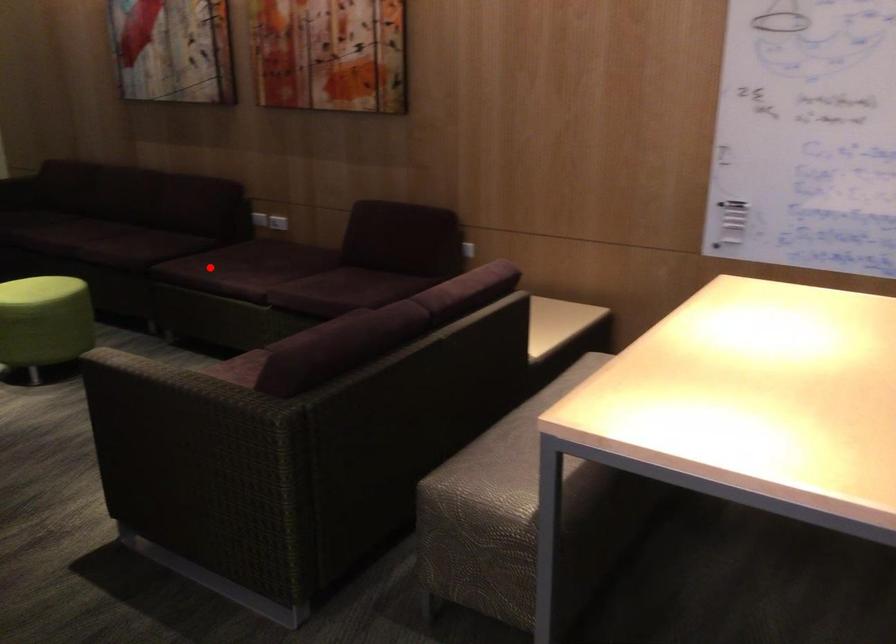
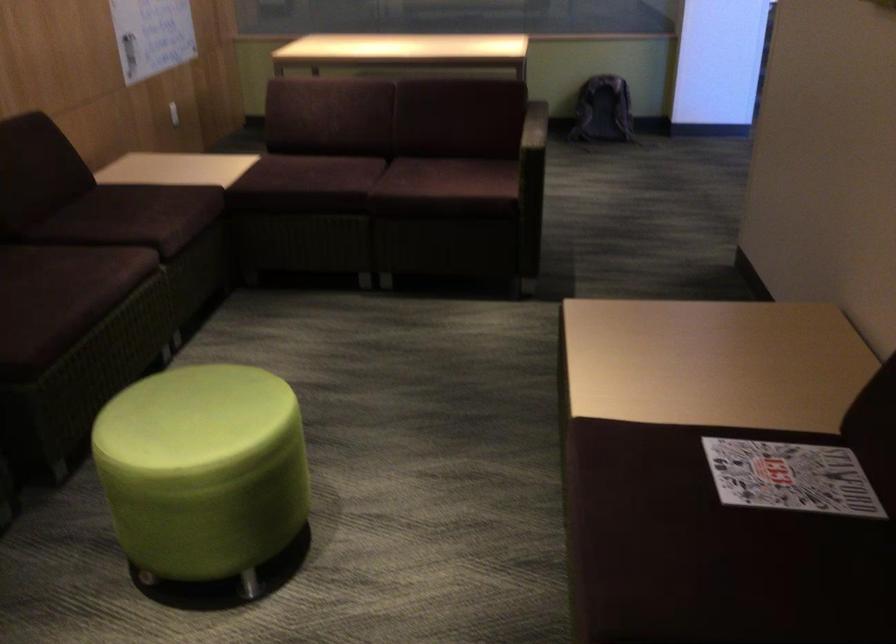
Question: I am providing you with two images of the same scene from different viewpoints. A red point is shown in image1. For the corresponding object point in image2, is it positioned nearer or farther from the camera?

Choices:
 (A) Nearer
 (B) Farther

Answer: (A)